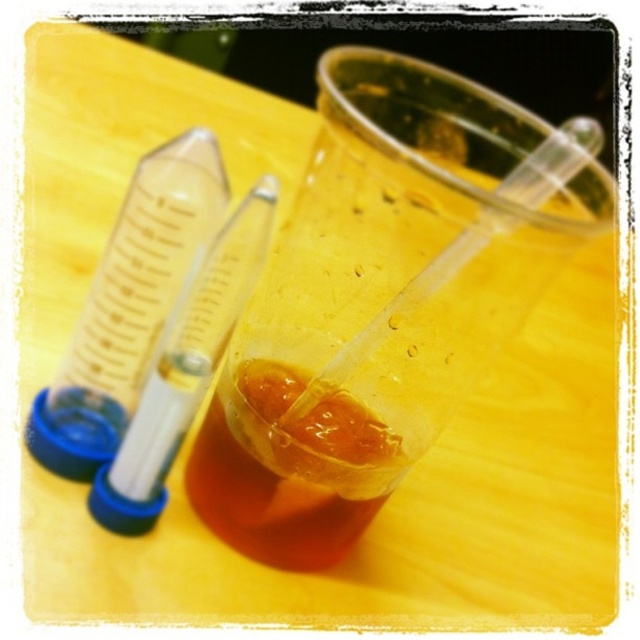
Question: Which object is the farthest from the translucent plastic cup at center?

Choices:
 (A) transparent plastic test tube at left
 (B) translucent amber liquid at center

Answer: (A)

Question: Does translucent plastic cup at center appear on the left side of translucent amber liquid at center?

Choices:
 (A) no
 (B) yes

Answer: (A)

Question: Does translucent plastic cup at center have a lesser width compared to transparent plastic test tube at left?

Choices:
 (A) yes
 (B) no

Answer: (B)

Question: Is transparent plastic test tube at left positioned in front of transparent plastic test tube at center?

Choices:
 (A) no
 (B) yes

Answer: (B)

Question: Which point is farther from the camera taking this photo?

Choices:
 (A) click(186, 168)
 (B) click(90, 508)
 (C) click(406, 300)
 (D) click(204, 506)

Answer: (D)

Question: Among these objects, which one is nearest to the camera?

Choices:
 (A) transparent plastic test tube at left
 (B) translucent plastic cup at center
 (C) translucent amber liquid at center
 (D) transparent plastic test tube at center

Answer: (B)